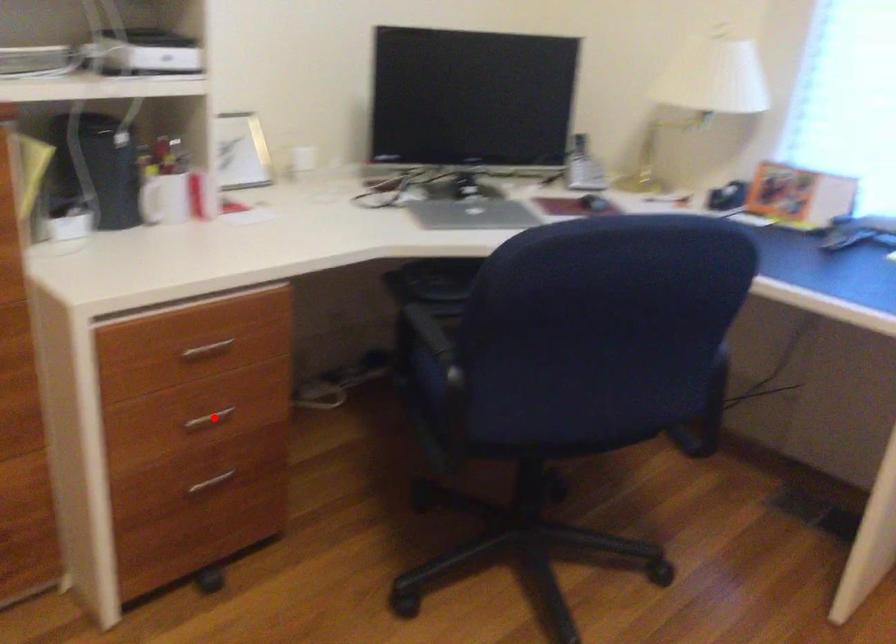
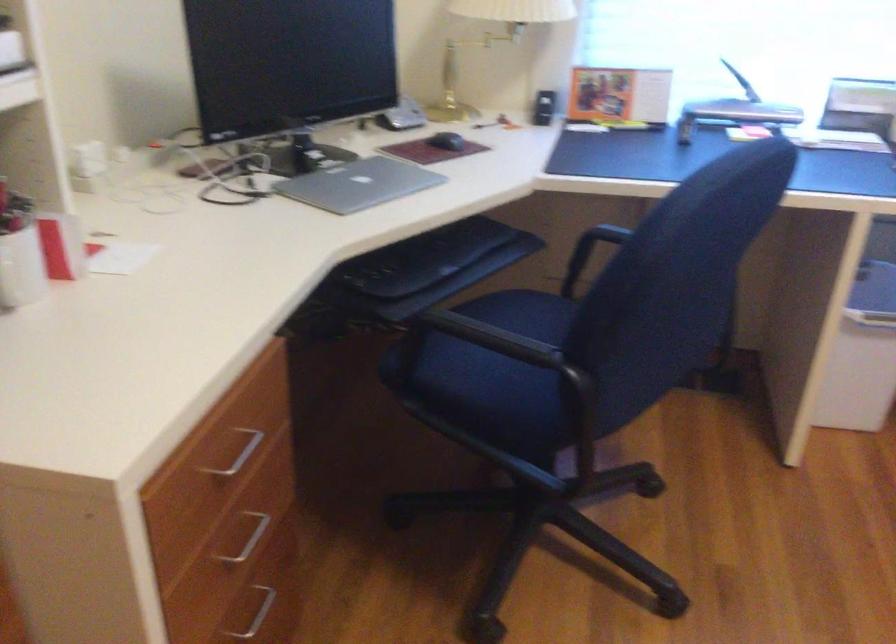
The point at the highlighted location is marked in the first image. Where is the corresponding point in the second image?

(247, 538)